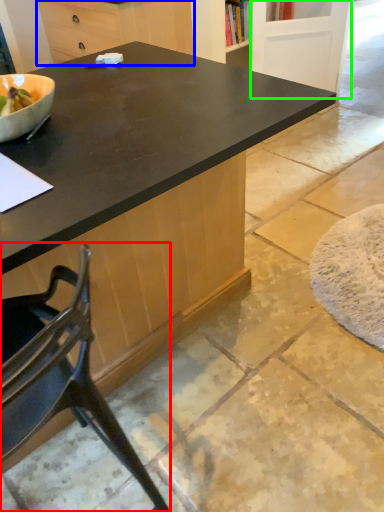
Question: Which object is positioned closest to chair (highlighted by a red box)? Select from cabinetry (highlighted by a blue box) and screen door (highlighted by a green box).

Choices:
 (A) cabinetry
 (B) screen door

Answer: (A)